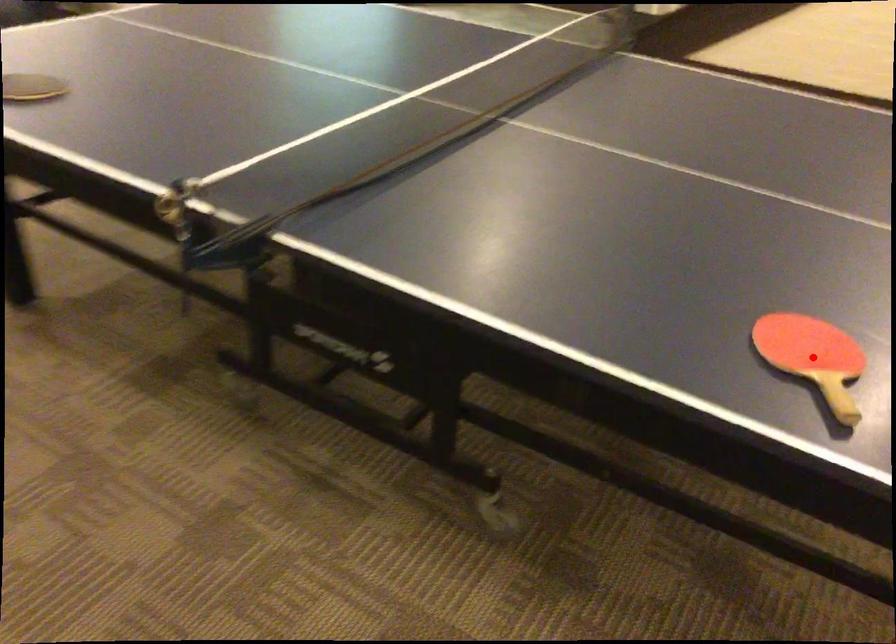
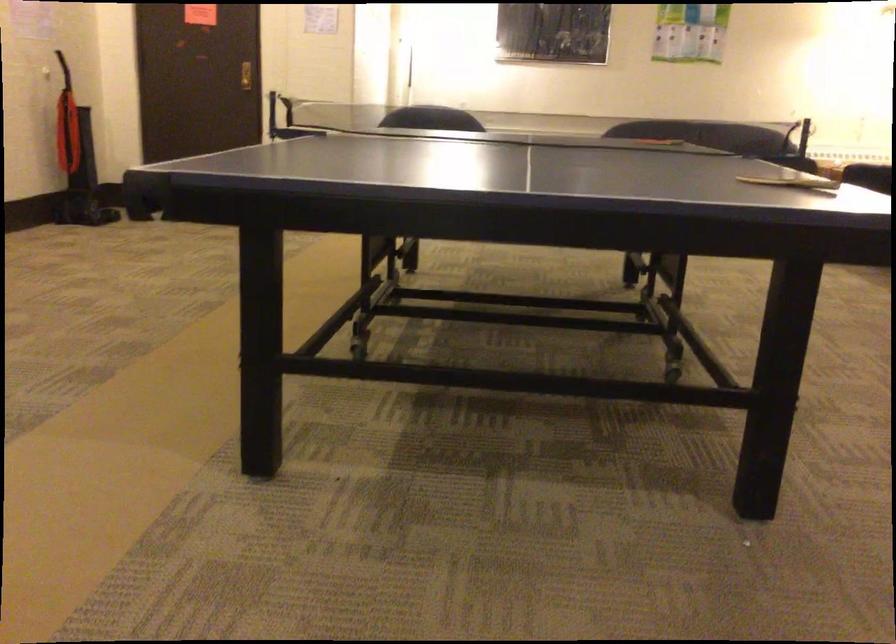
Question: I am providing you with two images of the same scene from different viewpoints. A red point is marked on the first image. Is the red point's position out of view in image 2?

Choices:
 (A) Yes
 (B) No

Answer: (A)